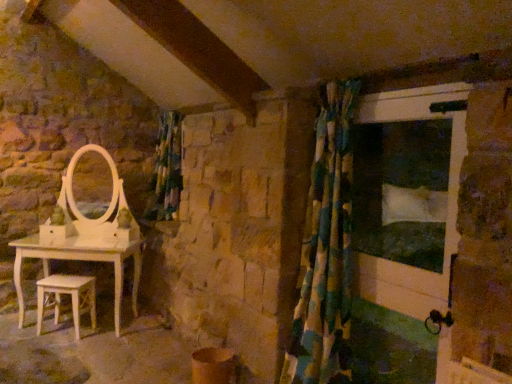
The width and height of the screenshot is (512, 384). Identify the location of vacant point above white painted wood screen door at right (from a real-world perspective). tap(402, 91).